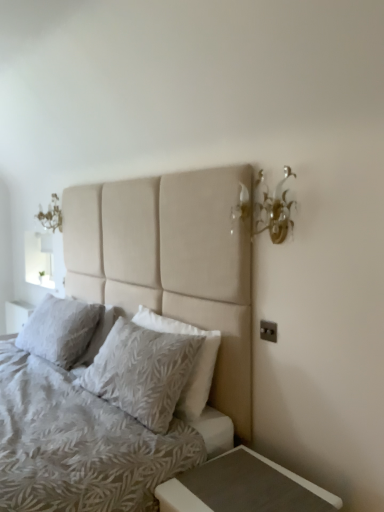
Question: Does textured beige pillow at center, marked as the 2th pillow in a back-to-front arrangement, come behind white textured pillow at center, the 2th pillow in the front-to-back sequence?

Choices:
 (A) no
 (B) yes

Answer: (A)

Question: From a real-world perspective, is textured beige pillow at center, which is counted as the first pillow, starting from the front, positioned under white textured pillow at center, positioned as the second pillow in right-to-left order, based on gravity?

Choices:
 (A) no
 (B) yes

Answer: (B)

Question: Does textured beige pillow at center, which appears as the first pillow when viewed from the right, have a lesser width compared to white textured pillow at center, acting as the 1th pillow starting from the back?

Choices:
 (A) no
 (B) yes

Answer: (B)

Question: Is the depth of textured beige pillow at center, which appears as the first pillow when viewed from the right, less than that of white textured pillow at center, positioned as the second pillow in right-to-left order?

Choices:
 (A) no
 (B) yes

Answer: (B)

Question: Considering the relative sizes of textured beige pillow at center, marked as the 2th pillow in a back-to-front arrangement, and white textured pillow at center, acting as the 1th pillow starting from the back, in the image provided, is textured beige pillow at center, marked as the 2th pillow in a back-to-front arrangement, shorter than white textured pillow at center, acting as the 1th pillow starting from the back,?

Choices:
 (A) no
 (B) yes

Answer: (A)

Question: Is textured beige pillow at center, which is counted as the first pillow, starting from the front, bigger or smaller than white frosted glass at upper left?

Choices:
 (A) small
 (B) big

Answer: (B)

Question: From the image's perspective, is textured beige pillow at center, marked as the 2th pillow in a back-to-front arrangement, above or below white frosted glass at upper left?

Choices:
 (A) above
 (B) below

Answer: (B)

Question: Would you say textured beige pillow at center, placed as the 2th pillow when sorted from left to right, is to the left or to the right of white frosted glass at upper left in the picture?

Choices:
 (A) right
 (B) left

Answer: (A)

Question: Is textured beige pillow at center, which is counted as the first pillow, starting from the front, inside or outside of white frosted glass at upper left?

Choices:
 (A) outside
 (B) inside

Answer: (A)

Question: In terms of size, does matte gray wood nightstand at lower right appear bigger or smaller than textured beige pillow at center, which appears as the first pillow when viewed from the right?

Choices:
 (A) small
 (B) big

Answer: (A)

Question: Is matte gray wood nightstand at lower right situated inside textured beige pillow at center, marked as the 2th pillow in a back-to-front arrangement, or outside?

Choices:
 (A) inside
 (B) outside

Answer: (B)

Question: In terms of height, does matte gray wood nightstand at lower right look taller or shorter compared to textured beige pillow at center, which appears as the first pillow when viewed from the right?

Choices:
 (A) tall
 (B) short

Answer: (B)

Question: From a real-world perspective, is matte gray wood nightstand at lower right above or below textured beige pillow at center, which appears as the first pillow when viewed from the right?

Choices:
 (A) above
 (B) below

Answer: (B)

Question: In the image, is matte gray wood nightstand at lower right positioned in front of or behind white frosted glass at upper left?

Choices:
 (A) behind
 (B) front

Answer: (B)

Question: Looking at the image, does matte gray wood nightstand at lower right seem bigger or smaller compared to white frosted glass at upper left?

Choices:
 (A) small
 (B) big

Answer: (A)